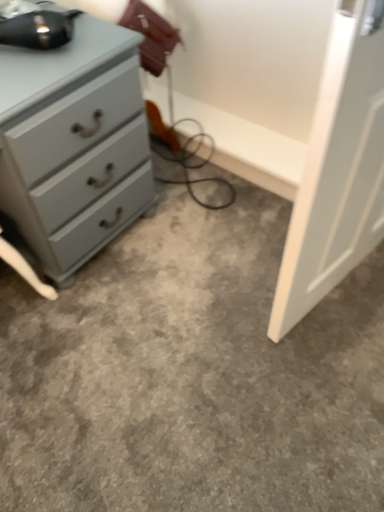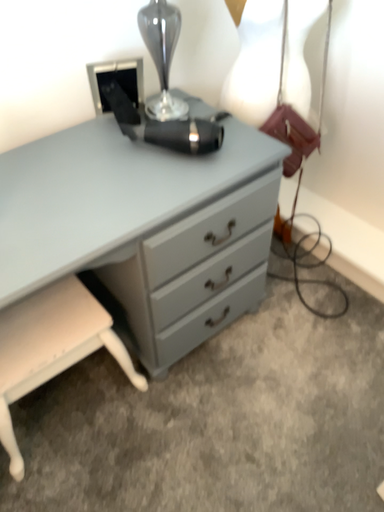
Question: Which way did the camera rotate in the video?

Choices:
 (A) rotated right
 (B) rotated left

Answer: (B)